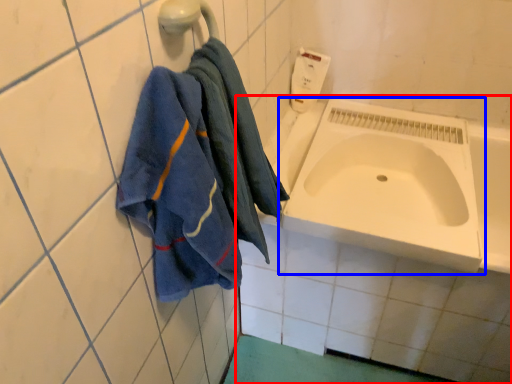
Question: Which point is closer to the camera, bath (highlighted by a red box) or sink (highlighted by a blue box)?

Choices:
 (A) bath
 (B) sink

Answer: (A)